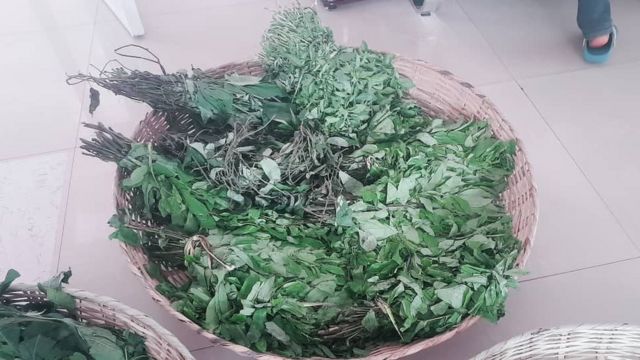
In order to click on vertical white edge, likely of an open door in this screenshot , I will do `click(130, 11)`.